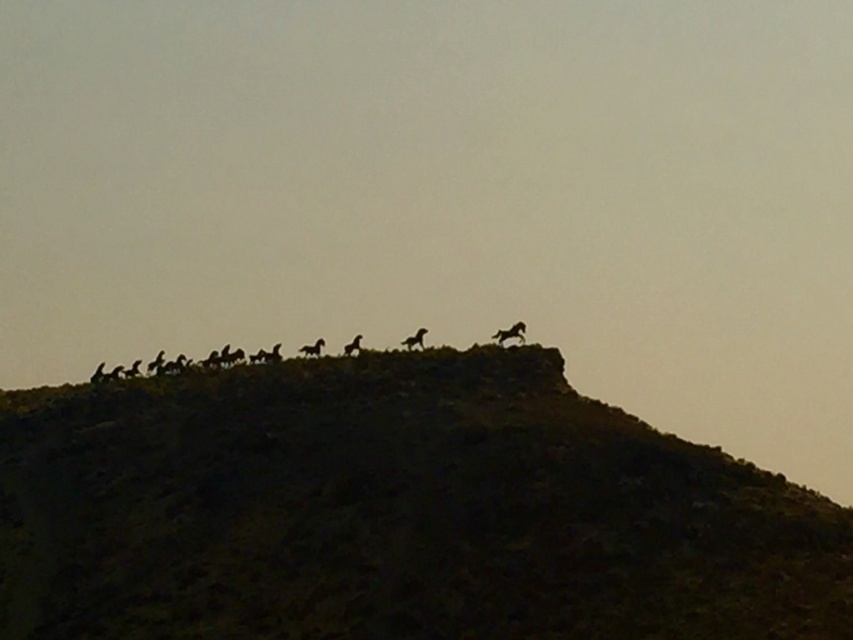
Consider the image. You are an artist trying to paint the scene. You notice the silhouette horse at center and the silhouette fur at upper center. Which one should you make smaller to maintain the correct proportions?

The silhouette horse at center should be made smaller because it occupies less space than the silhouette fur at upper center according to the description.

You are standing at the base of the hill in the image and see two points marked on the hillside. The first point is at coordinates point (x=416, y=339) and the second is at point (x=350, y=355). Which point is closer to you?

Point (x=416, y=339) is in front of point (x=350, y=355), so it is closer to you.

You are an artist trying to sketch the scene. You want to ensure the dark brown textured hillside at upper center and silhouette horse at upper center are proportionally accurate. Which object should you draw first to maintain the correct size relationship?

You should draw the dark brown textured hillside at upper center first because it is wider than the silhouette horse at upper center, allowing you to establish the correct size relationship before adding the smaller horse.